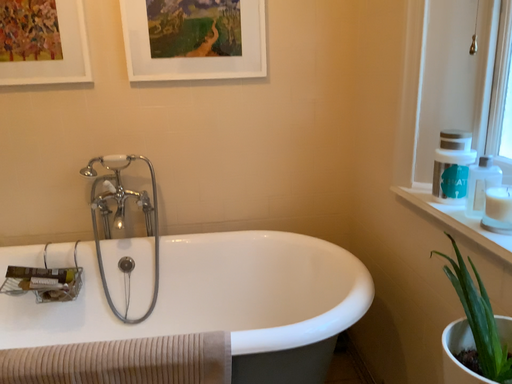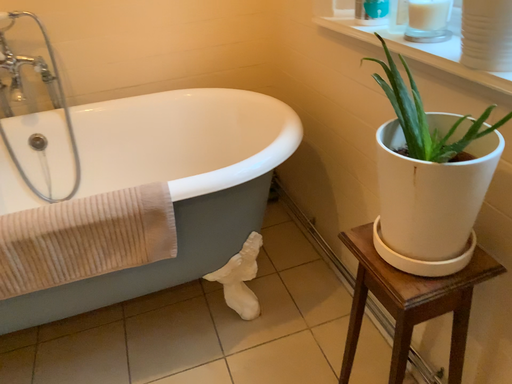
Question: How did the camera likely rotate when shooting the video?

Choices:
 (A) rotated right
 (B) rotated left

Answer: (A)